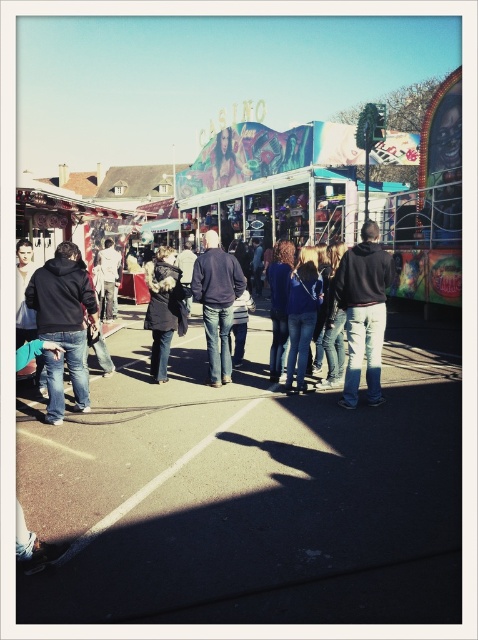
Question: Is dark blue hoodie at left closer to camera compared to jeans at center?

Choices:
 (A) no
 (B) yes

Answer: (B)

Question: Which object is the closest to the black asphalt at center?

Choices:
 (A) denim jacket at center
 (B) dark blue hoodie at left
 (C) blue jeans at center

Answer: (C)

Question: Among these points, which one is farthest from the camera?

Choices:
 (A) click(308, 272)
 (B) click(53, 372)

Answer: (A)

Question: Does dark brown leather jacket at center have a larger size compared to denim jacket at center?

Choices:
 (A) no
 (B) yes

Answer: (B)

Question: From the image, what is the correct spatial relationship of dark blue hoodie at left in relation to dark blue jeans at center?

Choices:
 (A) right
 (B) left

Answer: (B)

Question: Which point is farther to the camera?

Choices:
 (A) (x=312, y=276)
 (B) (x=105, y=518)
 (C) (x=108, y=291)
 (D) (x=229, y=356)

Answer: (C)